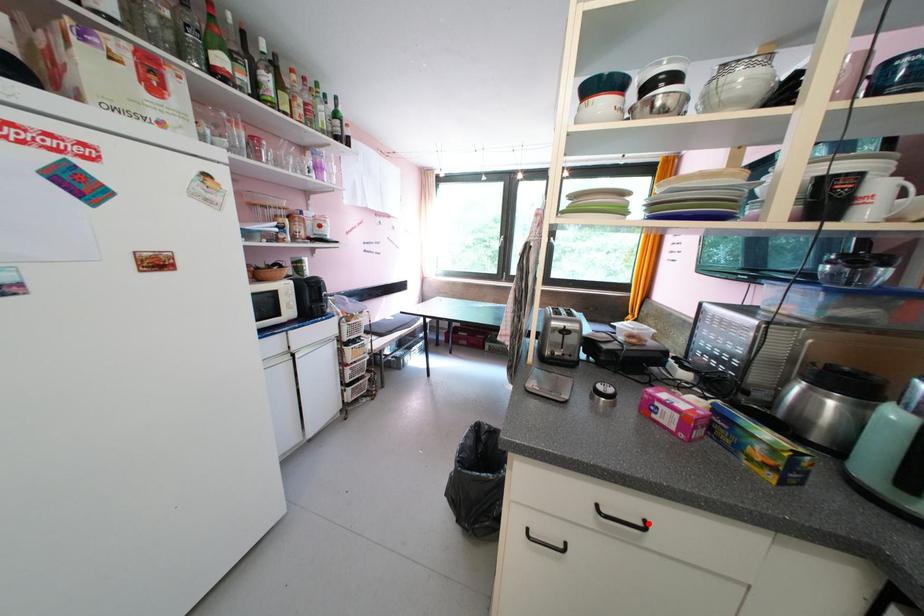
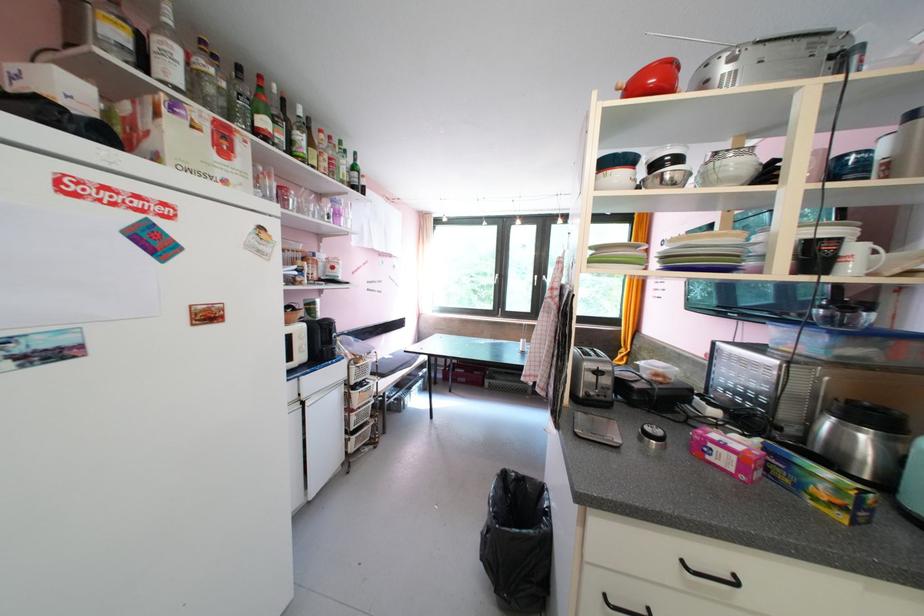
Question: I am providing you with two images of the same scene from different viewpoints. A red point is shown in image1. For the corresponding object point in image2, is it positioned nearer or farther from the camera?

Choices:
 (A) Nearer
 (B) Farther

Answer: (A)